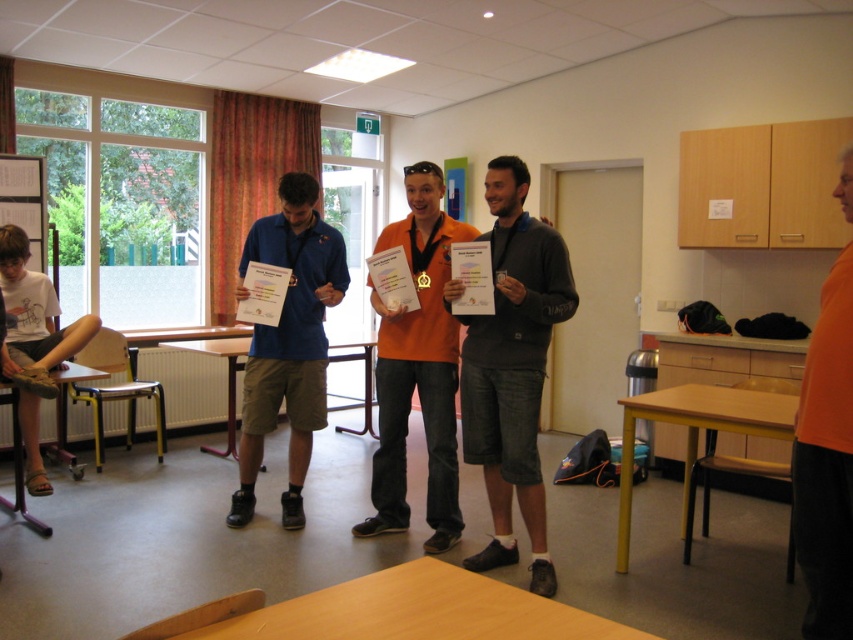
Looking at this image, can you confirm if blue fabric shirt at center is taller than metallic silver bulletin board at upper left?

Correct, blue fabric shirt at center is much taller as metallic silver bulletin board at upper left.

Does blue fabric shirt at center appear over metallic silver bulletin board at upper left?

Actually, blue fabric shirt at center is below metallic silver bulletin board at upper left.

Identify the location of blue fabric shirt at center. (288, 340).

I want to click on blue fabric shirt at center, so click(x=288, y=340).

Measure the distance between orange matte shirt at center and camera.

2.03 meters

Is orange matte shirt at center wider than metallic silver bulletin board at upper left?

No, orange matte shirt at center is not wider than metallic silver bulletin board at upper left.

The width and height of the screenshot is (853, 640). What do you see at coordinates (827, 461) in the screenshot? I see `orange matte shirt at center` at bounding box center [827, 461].

Locate an element on the screen. The width and height of the screenshot is (853, 640). orange matte shirt at center is located at coordinates (827, 461).

Does dark gray cotton shorts at center appear under metallic silver bulletin board at upper left?

Yes.

Looking at this image, who is more forward, (498, 388) or (27, 237)?

Point (498, 388) is more forward.

What are the coordinates of `dark gray cotton shorts at center` in the screenshot? It's located at (514, 369).